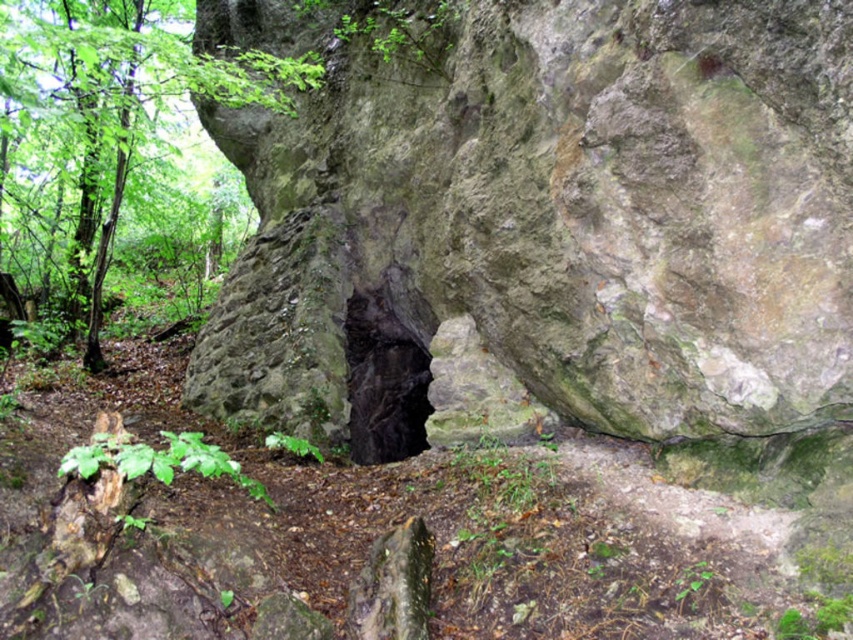
Question: Which is nearer to the green leafy tree at upper left?

Choices:
 (A) black stone hole at center
 (B) green mossy rock at center

Answer: (A)

Question: Which point is farther to the camera?

Choices:
 (A) black stone hole at center
 (B) green leafy tree at upper left

Answer: (A)

Question: Does green mossy rock at center appear over green leafy tree at upper left?

Choices:
 (A) no
 (B) yes

Answer: (A)

Question: Among these objects, which one is farthest from the camera?

Choices:
 (A) black stone hole at center
 (B) green mossy rock at center

Answer: (A)

Question: Does green mossy rock at center have a lesser width compared to green leafy tree at upper left?

Choices:
 (A) yes
 (B) no

Answer: (A)

Question: Is green mossy rock at center to the right of black stone hole at center from the viewer's perspective?

Choices:
 (A) no
 (B) yes

Answer: (A)